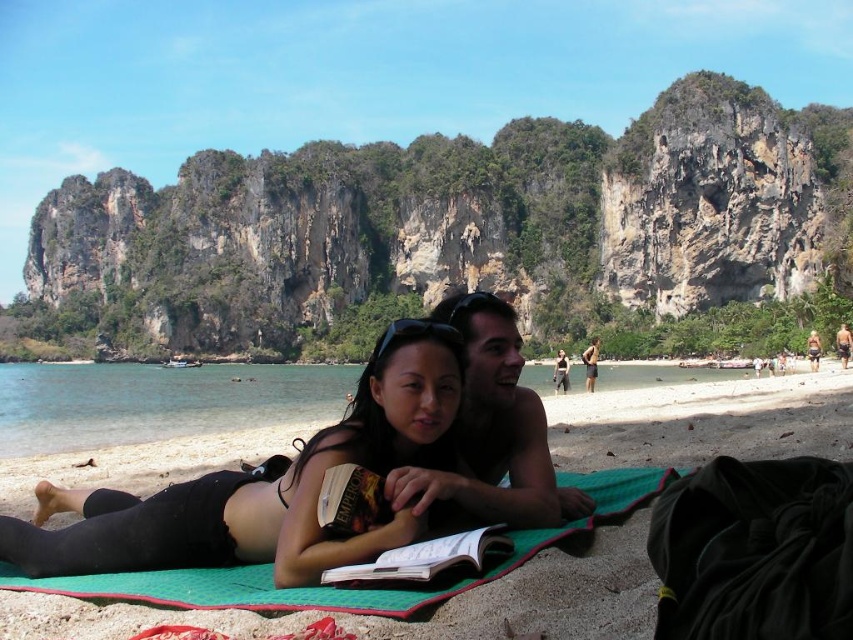
Question: Which point appears closest to the camera in this image?

Choices:
 (A) (463, 524)
 (B) (451, 344)

Answer: (A)

Question: Is green fabric at center to the left of smooth tan skin at center from the viewer's perspective?

Choices:
 (A) no
 (B) yes

Answer: (B)

Question: Which point is farther from the camera taking this photo?

Choices:
 (A) 338,401
 (B) 486,561
 (C) 584,493

Answer: (A)

Question: Which point is closer to the camera?

Choices:
 (A) smooth tan skin at center
 (B) hardcover book at center

Answer: (B)

Question: Is black matte bikini top at center thinner than smooth tan skin at center?

Choices:
 (A) no
 (B) yes

Answer: (A)

Question: Does black matte bikini top at center have a larger size compared to hardcover book at center?

Choices:
 (A) yes
 (B) no

Answer: (A)